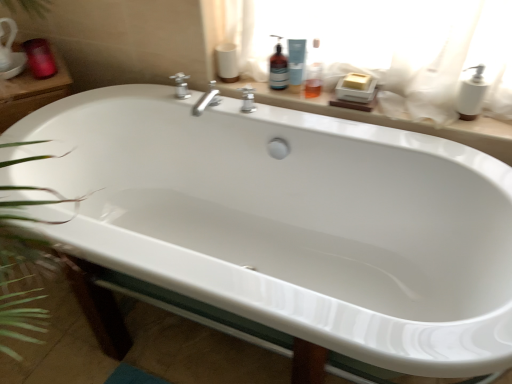
The height and width of the screenshot is (384, 512). In order to click on blank space to the left of translucent plastic bottle at upper center, placed as the 2th cleaning product when sorted from right to left in this screenshot , I will do `click(250, 91)`.